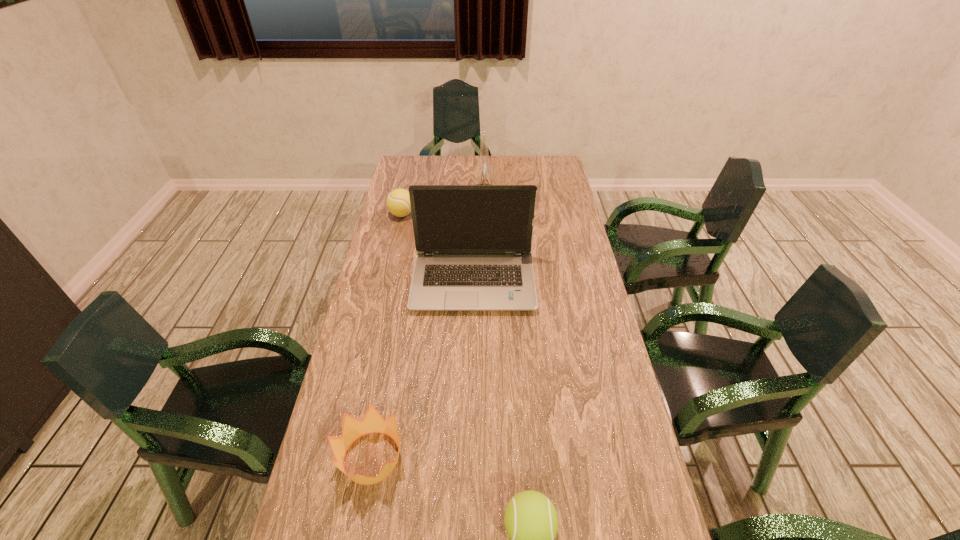
Locate an element on the screen. Image resolution: width=960 pixels, height=540 pixels. vacant point that satisfies the following two spatial constraints: 1. on the front side of the farther tennis ball; 2. on the left side of the crown is located at coordinates (348, 458).

Locate an element on the screen. The height and width of the screenshot is (540, 960). vacant space that satisfies the following two spatial constraints: 1. on the back side of the oil lamp; 2. on the left side of the crown is located at coordinates (417, 211).